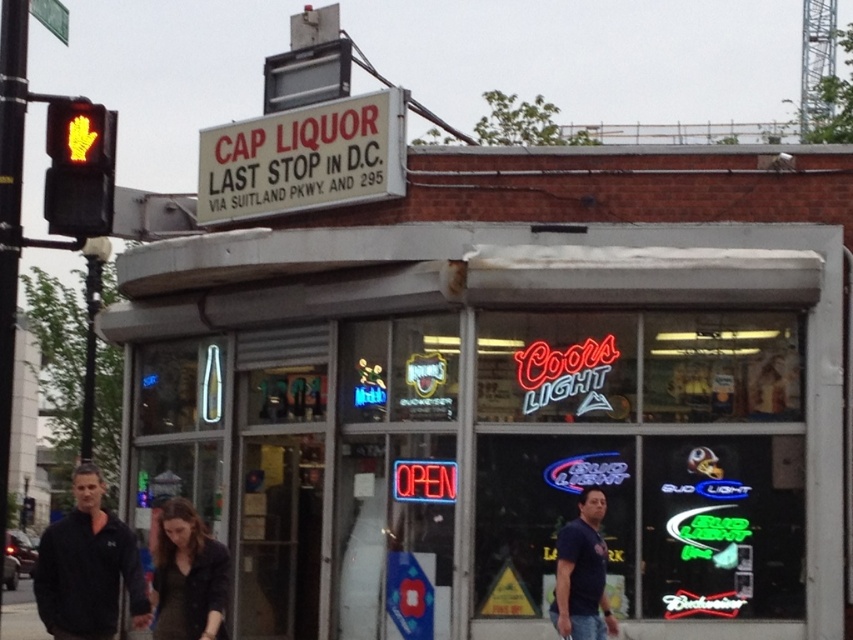
You are a customer standing outside the Cap Liquor store. You notice the white plastic sign at upper center and the red plastic hand at upper left. Which object is closer to you?

The red plastic hand at upper left is behind the white plastic sign at upper center, so the white plastic sign at upper center is closer to you.